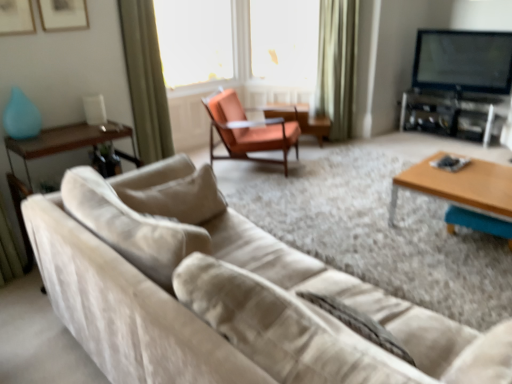
Question: Which direction should I rotate to look at transparent plastic screen at upper center, acting as the 2th window screen starting from the left, — up or down?

Choices:
 (A) up
 (B) down

Answer: (A)

Question: Should I look upward or downward to see wooden glossy side table at left, marked as the second side table in a top-to-bottom arrangement?

Choices:
 (A) up
 (B) down

Answer: (B)

Question: Is transparent plastic screen at upper center, acting as the 2th window screen starting from the left, oriented away from transparent plastic window screen at upper center, which appears as the 1th window screen when viewed from the left?

Choices:
 (A) yes
 (B) no

Answer: (B)

Question: Is transparent plastic screen at upper center, arranged as the 1th window screen when viewed from the right, directly adjacent to transparent plastic window screen at upper center, which appears as the 1th window screen when viewed from the left?

Choices:
 (A) no
 (B) yes

Answer: (A)

Question: From the image's perspective, is transparent plastic screen at upper center, arranged as the 1th window screen when viewed from the right, located above transparent plastic window screen at upper center, which ranks as the 2th window screen in right-to-left order?

Choices:
 (A) yes
 (B) no

Answer: (A)

Question: From a real-world perspective, is transparent plastic screen at upper center, arranged as the 1th window screen when viewed from the right, physically above transparent plastic window screen at upper center, which appears as the 1th window screen when viewed from the left?

Choices:
 (A) yes
 (B) no

Answer: (B)

Question: Could you tell me if transparent plastic screen at upper center, arranged as the 1th window screen when viewed from the right, is turned towards transparent plastic window screen at upper center, which ranks as the 2th window screen in right-to-left order?

Choices:
 (A) yes
 (B) no

Answer: (B)

Question: Considering the relative positions of transparent plastic screen at upper center, arranged as the 1th window screen when viewed from the right, and transparent plastic window screen at upper center, which ranks as the 2th window screen in right-to-left order, in the image provided, is transparent plastic screen at upper center, arranged as the 1th window screen when viewed from the right, in front of transparent plastic window screen at upper center, which ranks as the 2th window screen in right-to-left order,?

Choices:
 (A) yes
 (B) no

Answer: (B)

Question: Is transparent plastic window screen at upper center, which appears as the 1th window screen when viewed from the left, not inside green velvet curtain at upper center, positioned as the first curtain in back-to-front order?

Choices:
 (A) yes
 (B) no

Answer: (A)

Question: Is transparent plastic window screen at upper center, which ranks as the 2th window screen in right-to-left order, thinner than green velvet curtain at upper center, which is counted as the second curtain, starting from the left?

Choices:
 (A) no
 (B) yes

Answer: (B)

Question: Does transparent plastic window screen at upper center, which appears as the 1th window screen when viewed from the left, have a greater height compared to green velvet curtain at upper center, positioned as the 2th curtain in front-to-back order?

Choices:
 (A) no
 (B) yes

Answer: (A)

Question: Considering the relative sizes of transparent plastic window screen at upper center, which appears as the 1th window screen when viewed from the left, and green velvet curtain at upper center, positioned as the first curtain in back-to-front order, in the image provided, is transparent plastic window screen at upper center, which appears as the 1th window screen when viewed from the left, shorter than green velvet curtain at upper center, positioned as the first curtain in back-to-front order,?

Choices:
 (A) no
 (B) yes

Answer: (B)

Question: Could you tell me if transparent plastic window screen at upper center, which ranks as the 2th window screen in right-to-left order, is facing green velvet curtain at upper center, which ranks as the 1th curtain in right-to-left order?

Choices:
 (A) no
 (B) yes

Answer: (A)

Question: Is transparent plastic window screen at upper center, which appears as the 1th window screen when viewed from the left, wider than green velvet curtain at upper center, positioned as the first curtain in back-to-front order?

Choices:
 (A) yes
 (B) no

Answer: (B)

Question: Is green velvet curtain at upper center, which is counted as the second curtain, starting from the left, bigger than flat-screen tv at upper right?

Choices:
 (A) no
 (B) yes

Answer: (B)